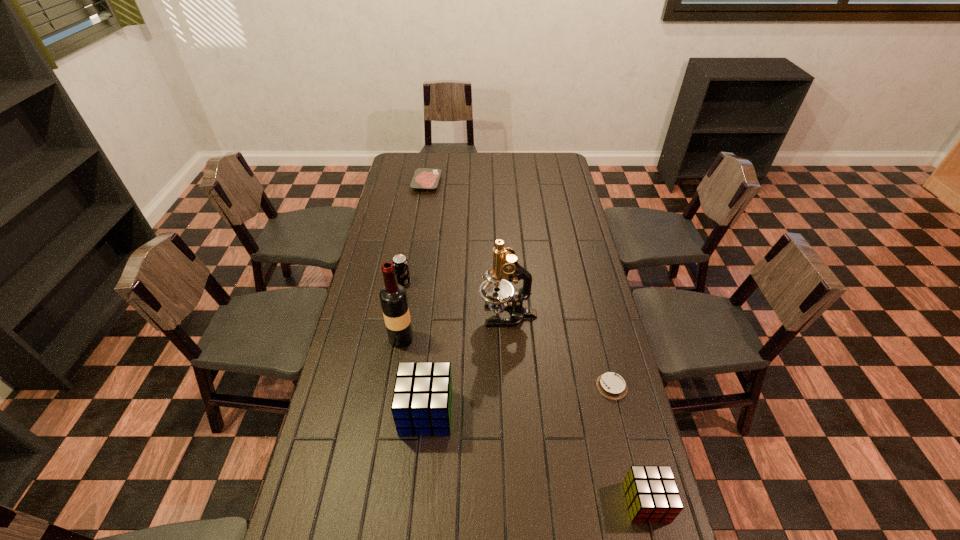
Image resolution: width=960 pixels, height=540 pixels. In order to click on the farther cube in this screenshot , I will do `click(421, 405)`.

I want to click on the taller cube, so click(421, 405).

You are a GUI agent. You are given a task and a screenshot of the screen. Output one action in this format:
    pyautogui.click(x=<x>, y=<y>)
    Task: Click on the shorter cube
    This screenshot has width=960, height=540.
    Given the screenshot: What is the action you would take?
    pyautogui.click(x=652, y=495)

This screenshot has width=960, height=540. In order to click on the right cube in this screenshot , I will do `click(652, 495)`.

Where is `steak`? The width and height of the screenshot is (960, 540). steak is located at coordinates (423, 178).

The height and width of the screenshot is (540, 960). What are the coordinates of `the third object from right to left` in the screenshot? It's located at (498, 293).

Locate an element on the screen. the fourth tallest object is located at coordinates (400, 262).

I want to click on the sixth nearest object, so click(400, 262).

You are a GUI agent. You are given a task and a screenshot of the screen. Output one action in this format:
    pyautogui.click(x=<x>, y=<y>)
    Task: Click on the chocolate cake
    This screenshot has height=540, width=960.
    Given the screenshot: What is the action you would take?
    pyautogui.click(x=611, y=385)

Where is `wine bottle`? Image resolution: width=960 pixels, height=540 pixels. wine bottle is located at coordinates (393, 297).